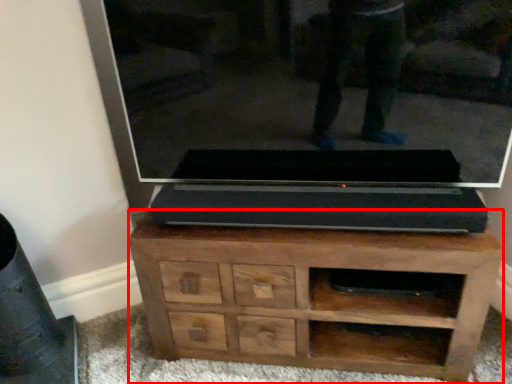
Question: Where is chest of drawers (annotated by the red box) located in relation to glass door in the image?

Choices:
 (A) right
 (B) left

Answer: (A)